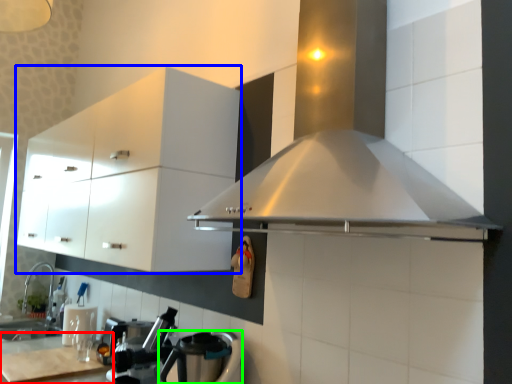
Question: Which object is positioned farthest from counter top (highlighted by a red box)? Select from cabinetry (highlighted by a blue box) and kitchen appliance (highlighted by a green box).

Choices:
 (A) cabinetry
 (B) kitchen appliance

Answer: (A)